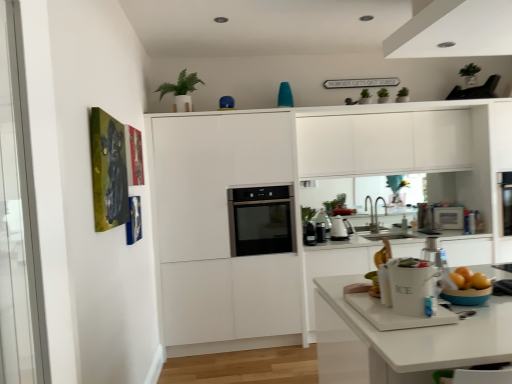
Question: From the image's perspective, is white ceramic ice bucket at lower center above or below white glossy kettle at center, which ranks as the third appliance in left-to-right order?

Choices:
 (A) above
 (B) below

Answer: (B)

Question: In terms of width, does white ceramic ice bucket at lower center look wider or thinner when compared to white glossy kettle at center, which appears as the 2th appliance when viewed from the right?

Choices:
 (A) wide
 (B) thin

Answer: (A)

Question: Based on their relative distances, which object is farther from the white glossy kettle at center, which appears as the 2th appliance when viewed from the right?

Choices:
 (A) white ceramic ice bucket at lower center
 (B) satin silver microwave at upper right, the fourth appliance when ordered from left to right
 (C) silver metallic faucet at center
 (D) black glass oven at center
 (E) black plastic coffee maker at center, which is the 1th appliance from left to right

Answer: (A)

Question: Which of these objects is positioned farthest from the black matte coffee maker at center, arranged as the 2th appliance when viewed from the left?

Choices:
 (A) green matte plant at upper center
 (B) satin silver microwave at upper right, which is the first appliance in back-to-front order
 (C) white ceramic ice bucket at lower center
 (D) white glossy kettle at center, which appears as the 2th appliance when viewed from the right
 (E) black plastic coffee maker at center, the first appliance from the front

Answer: (C)